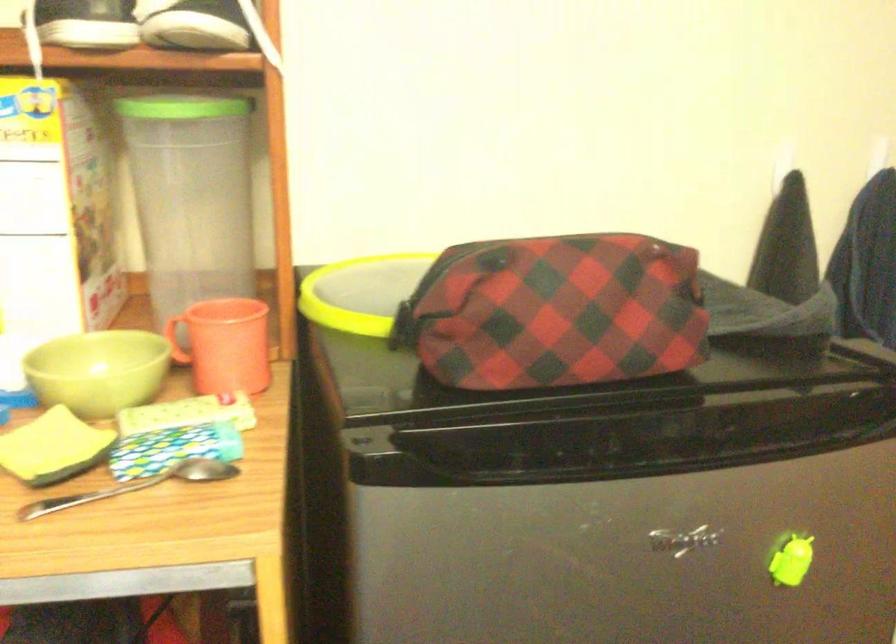
Find where to lift the green bowl. Please return your answer as a coordinate pair (x, y).

(98, 371)